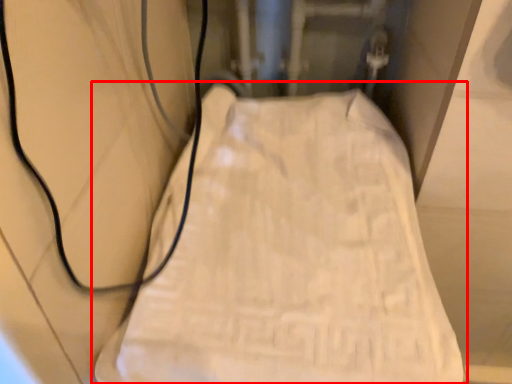
Question: In this image, where is furniture (annotated by the red box) located relative to wire?

Choices:
 (A) left
 (B) right

Answer: (B)